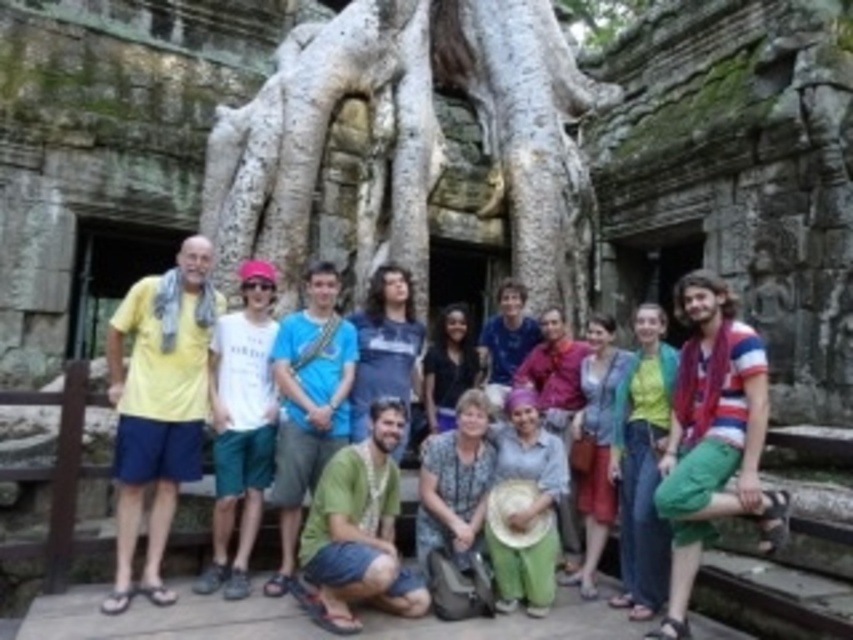
Image resolution: width=853 pixels, height=640 pixels. What do you see at coordinates (308, 403) in the screenshot?
I see `blue fabric shirt at center` at bounding box center [308, 403].

Does blue fabric shirt at center have a greater height compared to green cotton pants at center?

Indeed, blue fabric shirt at center has a greater height compared to green cotton pants at center.

Measure the distance between point (332, 332) and camera.

Point (332, 332) and camera are 57.29 meters apart from each other.

This screenshot has height=640, width=853. What are the coordinates of `blue fabric shirt at center` in the screenshot? It's located at 308,403.

Based on the photo, is blue fabric shirt at center shorter than black matte shirt at center?

No.

Between point (309, 461) and point (440, 360), which one is positioned behind?

Positioned behind is point (440, 360).

Describe the element at coordinates (308, 403) in the screenshot. Image resolution: width=853 pixels, height=640 pixels. I see `blue fabric shirt at center` at that location.

This screenshot has width=853, height=640. I want to click on blue fabric shirt at center, so click(x=308, y=403).

Is point (224, 547) closer to viewer compared to point (595, 529)?

Yes, it is in front of point (595, 529).

Does point (242, 365) lie behind point (595, 385)?

No, it is not.

You are a GUI agent. You are given a task and a screenshot of the screen. Output one action in this format:
    pyautogui.click(x=<x>, y=<y>)
    Task: Click on the white cotton t-shirt at center
    Image resolution: width=853 pixels, height=640 pixels.
    Given the screenshot: What is the action you would take?
    pyautogui.click(x=241, y=424)